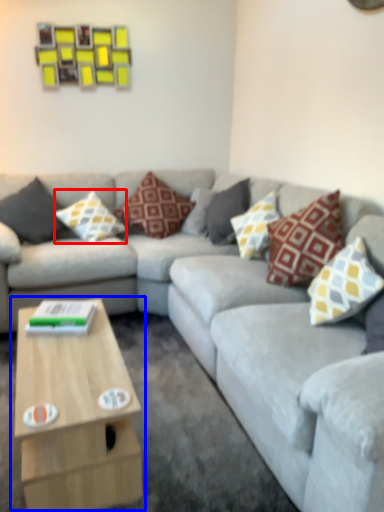
Question: Among these objects, which one is nearest to the camera, pillow (highlighted by a red box) or coffee table (highlighted by a blue box)?

Choices:
 (A) pillow
 (B) coffee table

Answer: (B)